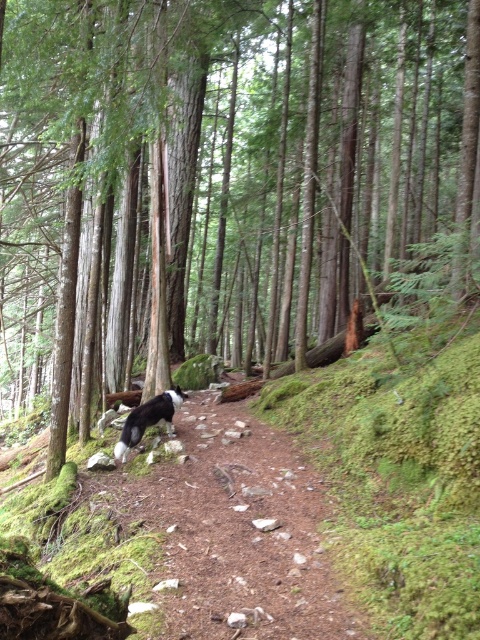
You are a hiker who wants to follow the path through the forest. You notice both the brown dirt trail at center and the black and white fur at center. Which object is bigger in size?

The brown dirt trail at center is larger in size than the black and white fur at center.

You are a hiker carrying a heavy backpack and want to reach a point marked at coordinates (230, 500) in the forest scene. The path is narrow and uneven. Can you safely walk to that point without needing to climb over obstacles?

The point at coordinates (230, 500) is 18.56 feet away from the camera. Since the path is described as narrow and uneven with small rocks and debris, you can walk there but may need to step carefully around obstacles. Climbing is not required.